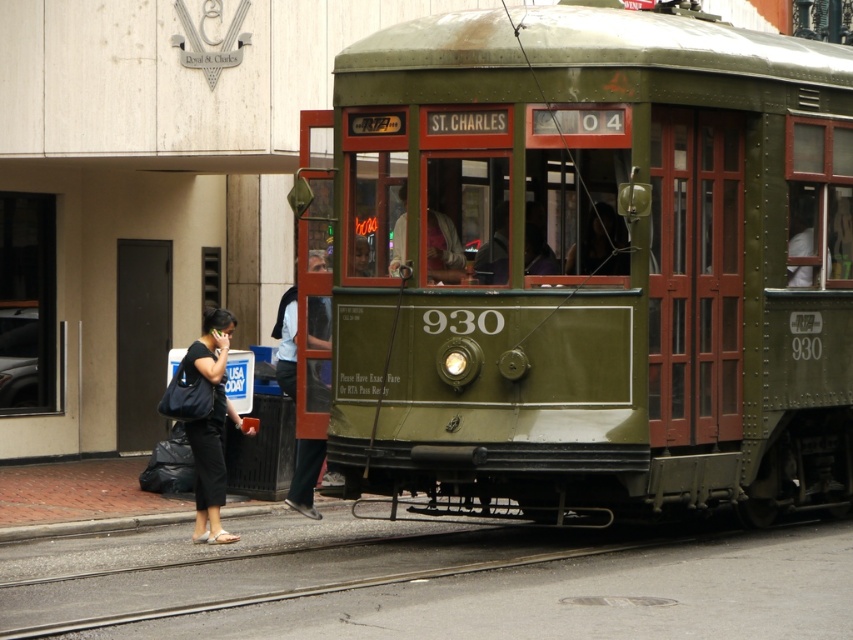
Question: Considering the real-world distances, which object is farthest from the black fabric bag at lower left?

Choices:
 (A) black asphalt train track at lower center
 (B) green metal train car at center

Answer: (A)

Question: Estimate the real-world distances between objects in this image. Which object is farther from the black asphalt train track at lower center?

Choices:
 (A) black fabric bag at lower left
 (B) green metal train car at center
 (C) dark blue jeans at center

Answer: (C)

Question: Which point is farther from the camera taking this photo?

Choices:
 (A) (466, 564)
 (B) (195, 486)

Answer: (B)

Question: Is green metal train car at center to the right of black asphalt train track at lower center from the viewer's perspective?

Choices:
 (A) yes
 (B) no

Answer: (B)

Question: Can you confirm if green metal train car at center is wider than black fabric bag at lower left?

Choices:
 (A) no
 (B) yes

Answer: (B)

Question: Does black asphalt train track at lower center appear on the right side of black fabric bag at lower left?

Choices:
 (A) no
 (B) yes

Answer: (B)